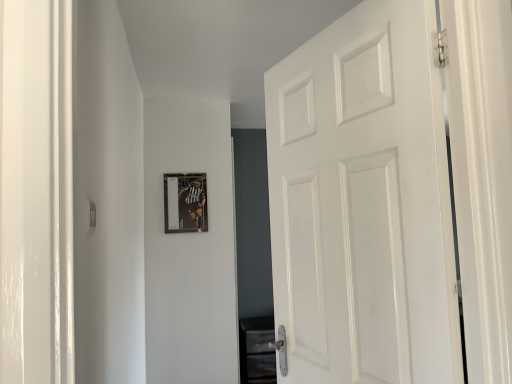
This screenshot has height=384, width=512. What are the coordinates of `matte plastic picture frame at center` in the screenshot? It's located at (185, 203).

The image size is (512, 384). What do you see at coordinates (185, 203) in the screenshot?
I see `matte plastic picture frame at center` at bounding box center [185, 203].

This screenshot has height=384, width=512. I want to click on matte plastic picture frame at center, so click(185, 203).